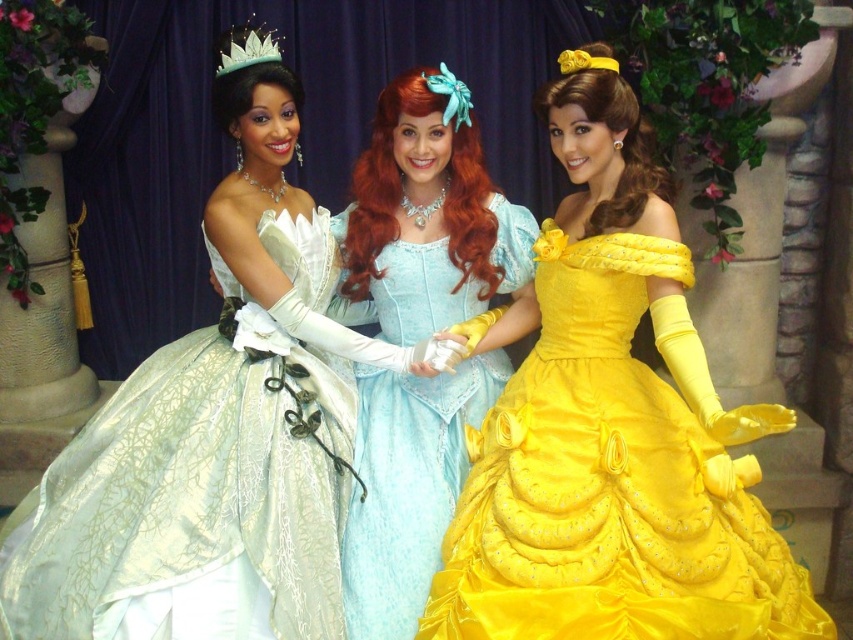
Question: Which of these objects is positioned closest to the light blue satin dress at center?

Choices:
 (A) matte green gown at center
 (B) yellow satin dress at center
 (C) matte silver tiara at upper center
 (D) matte silver gown at center

Answer: (D)

Question: Does matte silver gown at center appear on the left side of yellow satin tiara at upper center?

Choices:
 (A) no
 (B) yes

Answer: (B)

Question: Which of these objects is positioned farthest from the light blue satin dress at center?

Choices:
 (A) matte silver gown at center
 (B) yellow satin tiara at upper center

Answer: (B)

Question: Can you confirm if yellow satin dress at center is positioned to the left of light blue satin dress at center?

Choices:
 (A) yes
 (B) no

Answer: (B)

Question: Can you confirm if yellow satin dress at center is smaller than yellow satin tiara at upper center?

Choices:
 (A) no
 (B) yes

Answer: (A)

Question: Which point appears farthest from the camera in this image?

Choices:
 (A) (129, 550)
 (B) (460, 216)
 (C) (566, 58)
 (D) (396, 417)

Answer: (B)